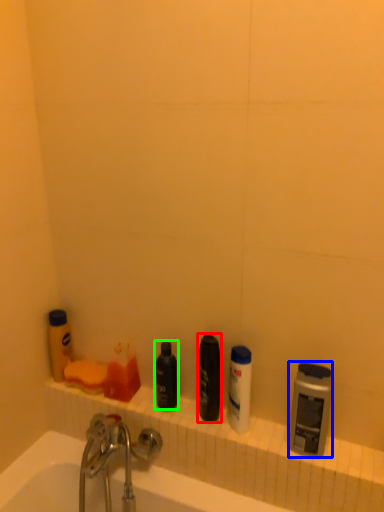
Question: Estimate the real-world distances between objects in this image. Which object is farther from toiletry (highlighted by a red box), toiletry (highlighted by a blue box) or toiletry (highlighted by a green box)?

Choices:
 (A) toiletry
 (B) toiletry

Answer: (A)